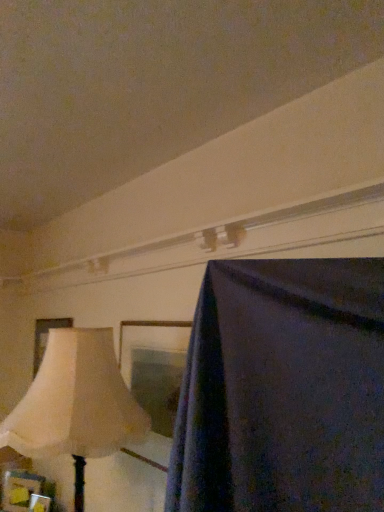
Question: Would you say beige fabric lampshade at left is outside wooden picture frame at lower left, placed as the second picture frame when sorted from top to bottom?

Choices:
 (A) no
 (B) yes

Answer: (B)

Question: Would you consider beige fabric lampshade at left to be distant from wooden picture frame at lower left, acting as the 1th picture frame starting from the front?

Choices:
 (A) yes
 (B) no

Answer: (A)

Question: Considering the relative sizes of beige fabric lampshade at left and wooden picture frame at lower left, which appears as the third picture frame when viewed from the back, in the image provided, is beige fabric lampshade at left wider than wooden picture frame at lower left, which appears as the third picture frame when viewed from the back,?

Choices:
 (A) no
 (B) yes

Answer: (B)

Question: Can you confirm if beige fabric lampshade at left is smaller than wooden picture frame at lower left, marked as the second picture frame in a bottom-to-top arrangement?

Choices:
 (A) yes
 (B) no

Answer: (B)

Question: Can wooden picture frame at lower left, which appears as the third picture frame when viewed from the back, be found inside beige fabric lampshade at left?

Choices:
 (A) no
 (B) yes

Answer: (A)

Question: From a real-world perspective, is matte cream picture frame at left, the 1th picture frame in the top-to-bottom sequence, positioned above or below wooden picture frame at lower left, the 2th picture frame from the back?

Choices:
 (A) above
 (B) below

Answer: (A)

Question: Considering the positions of matte cream picture frame at left, the third picture frame when ordered from bottom to top, and wooden picture frame at lower left, the first picture frame when ordered from bottom to top, in the image, is matte cream picture frame at left, the third picture frame when ordered from bottom to top, taller or shorter than wooden picture frame at lower left, the first picture frame when ordered from bottom to top,?

Choices:
 (A) tall
 (B) short

Answer: (A)

Question: Does point (41, 358) appear closer or farther from the camera than point (4, 507)?

Choices:
 (A) farther
 (B) closer

Answer: (A)

Question: Which is correct: matte cream picture frame at left, the third picture frame when ordered from bottom to top, is inside wooden picture frame at lower left, placed as the second picture frame when sorted from front to back, or outside of it?

Choices:
 (A) inside
 (B) outside

Answer: (B)

Question: Considering the positions of matte cream picture frame at left, the 1th picture frame in the top-to-bottom sequence, and beige fabric lampshade at left in the image, is matte cream picture frame at left, the 1th picture frame in the top-to-bottom sequence, bigger or smaller than beige fabric lampshade at left?

Choices:
 (A) big
 (B) small

Answer: (B)

Question: Visually, is matte cream picture frame at left, the third picture frame when ordered from bottom to top, positioned to the left or to the right of beige fabric lampshade at left?

Choices:
 (A) left
 (B) right

Answer: (A)

Question: Is matte cream picture frame at left, the first picture frame when ordered from back to front, wider or thinner than beige fabric lampshade at left?

Choices:
 (A) wide
 (B) thin

Answer: (B)

Question: Considering the positions of matte cream picture frame at left, which is the third picture frame from front to back, and beige fabric lampshade at left in the image, is matte cream picture frame at left, which is the third picture frame from front to back, taller or shorter than beige fabric lampshade at left?

Choices:
 (A) tall
 (B) short

Answer: (B)

Question: Looking at their shapes, would you say wooden picture frame at lower left, which appears as the third picture frame when viewed from the back, is wider or thinner than beige fabric lampshade at left?

Choices:
 (A) thin
 (B) wide

Answer: (A)

Question: Is wooden picture frame at lower left, which appears as the third picture frame when viewed from the back, in front of or behind beige fabric lampshade at left in the image?

Choices:
 (A) front
 (B) behind

Answer: (B)